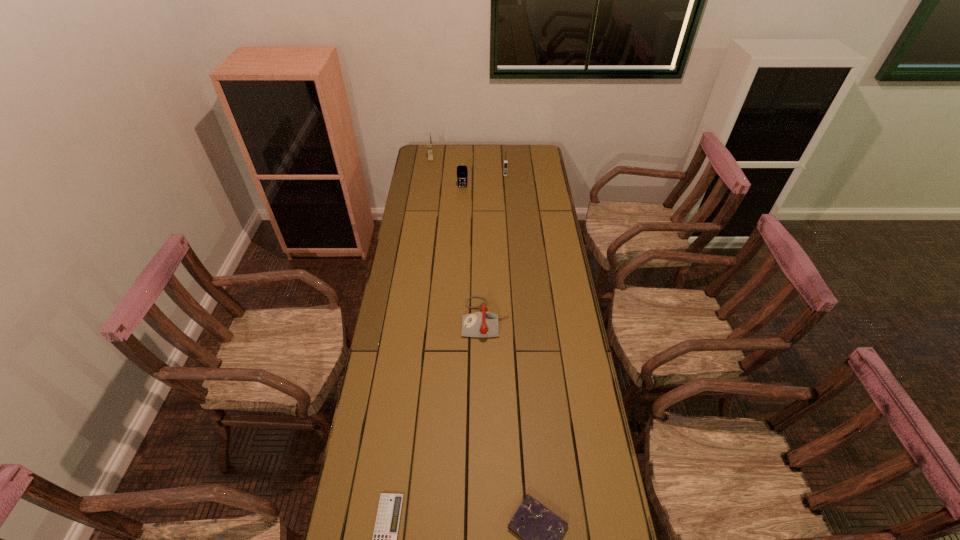
Identify the location of vacant space that's between the tallest cellular telephone and the fourth nearest object. This screenshot has width=960, height=540. (446, 173).

The image size is (960, 540). I want to click on free space that is in between the third farthest object and the tallest cellular telephone, so click(x=446, y=173).

This screenshot has height=540, width=960. What are the coordinates of `free space between the second cellular telephone from left to right and the farthest cellular telephone` in the screenshot? It's located at (446, 173).

Identify which object is the nearest to the telephone. Please provide its 2D coordinates. Your answer should be formatted as a tuple, i.e. [(x, y)], where the tuple contains the x and y coordinates of a point satisfying the conditions above.

[(540, 529)]

Find the location of `object that is the fifth closest to the second shortest object`. object that is the fifth closest to the second shortest object is located at coordinates (429, 144).

At what (x,y) coordinates should I click in order to perform the action: click on cellular telephone that is the second closest to the fourth nearest object. Please return your answer as a coordinate pair (x, y). Looking at the image, I should click on point(429,144).

You are a GUI agent. You are given a task and a screenshot of the screen. Output one action in this format:
    pyautogui.click(x=<x>, y=<y>)
    Task: Click on the cellular telephone that is the third closest to the shortest object
    The image size is (960, 540).
    Given the screenshot: What is the action you would take?
    pyautogui.click(x=429, y=144)

At what (x,y) coordinates should I click in order to perform the action: click on vacant space that satisfies the following two spatial constraints: 1. on the front-facing side of the second farthest cellular telephone; 2. on the dial of the fourth tallest object. Please return your answer as a coordinate pair (x, y). The image size is (960, 540). Looking at the image, I should click on (516, 318).

You are a GUI agent. You are given a task and a screenshot of the screen. Output one action in this format:
    pyautogui.click(x=<x>, y=<y>)
    Task: Click on the vacant space that satisfies the following two spatial constraints: 1. on the front-facing side of the second nearest cellular telephone; 2. on the dial of the fourth farthest object
    
    Given the screenshot: What is the action you would take?
    pyautogui.click(x=516, y=318)